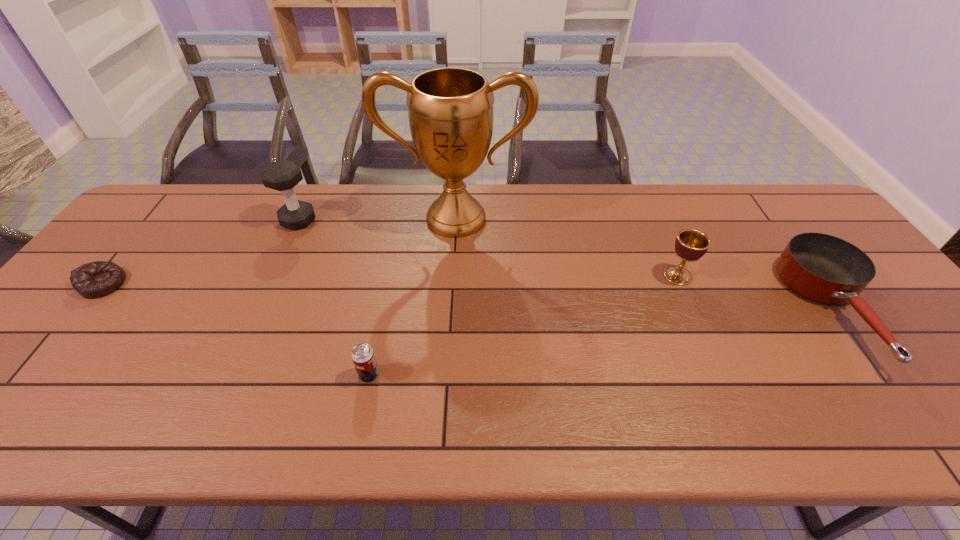
At what (x,y) coordinates should I click in order to perform the action: click on free area in between the third tallest object and the leftmost object. Please return your answer as a coordinate pair (x, y). Looking at the image, I should click on (391, 280).

Find the location of `vacant space that's between the dumbbell and the rightmost object`. vacant space that's between the dumbbell and the rightmost object is located at coordinates (567, 265).

Find the location of a particular element. The height and width of the screenshot is (540, 960). free space between the fourth shortest object and the rightmost object is located at coordinates (756, 292).

Identify which object is the fifth nearest to the tallest object. Please provide its 2D coordinates. Your answer should be formatted as a tuple, i.e. [(x, y)], where the tuple contains the x and y coordinates of a point satisfying the conditions above.

[(93, 280)]

Identify which object is the closest to the rightmost object. Please provide its 2D coordinates. Your answer should be formatted as a tuple, i.e. [(x, y)], where the tuple contains the x and y coordinates of a point satisfying the conditions above.

[(690, 245)]

Image resolution: width=960 pixels, height=540 pixels. Identify the location of free spot that satisfies the following two spatial constraints: 1. on the surface of the trophy cup with symbols; 2. on the left side of the third tallest object. (453, 275).

At what (x,y) coordinates should I click in order to perform the action: click on free space that satisfies the following two spatial constraints: 1. on the back side of the beer can; 2. on the left side of the chalice. Please return your answer as a coordinate pair (x, y). Looking at the image, I should click on (389, 275).